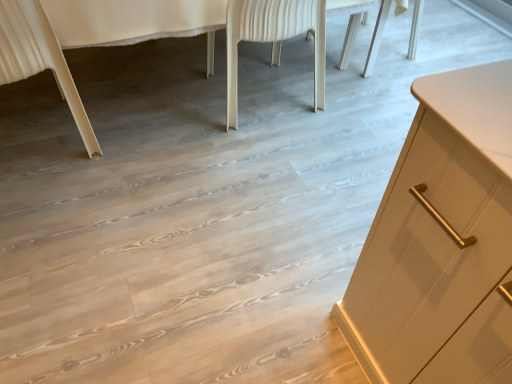
Question: From a real-world perspective, is white wood chair at center, which appears as the second chair when viewed from the left, on light beige wood chair leg at lower left, placed as the 1th chair when sorted from left to right?

Choices:
 (A) yes
 (B) no

Answer: (B)

Question: From a real-world perspective, is white wood chair at center, marked as the 1th chair in a right-to-left arrangement, under light beige wood chair leg at lower left, which is counted as the 2th chair, starting from the right?

Choices:
 (A) no
 (B) yes

Answer: (B)

Question: Is white wood chair at center, marked as the 1th chair in a right-to-left arrangement, not close to light beige wood chair leg at lower left, placed as the 1th chair when sorted from left to right?

Choices:
 (A) no
 (B) yes

Answer: (A)

Question: Does white wood chair at center, which appears as the second chair when viewed from the left, have a lesser width compared to light beige wood chair leg at lower left, placed as the 1th chair when sorted from left to right?

Choices:
 (A) no
 (B) yes

Answer: (A)

Question: Does white wood chair at center, which appears as the second chair when viewed from the left, touch light beige wood chair leg at lower left, placed as the 1th chair when sorted from left to right?

Choices:
 (A) no
 (B) yes

Answer: (A)

Question: From the image's perspective, is white wood chair at center, which appears as the second chair when viewed from the left, beneath light beige wood chair leg at lower left, placed as the 1th chair when sorted from left to right?

Choices:
 (A) yes
 (B) no

Answer: (B)

Question: Is white wood chair at center, marked as the 1th chair in a right-to-left arrangement, not within white glossy cabinet at right?

Choices:
 (A) no
 (B) yes

Answer: (A)

Question: Is white wood chair at center, which appears as the second chair when viewed from the left, oriented away from white glossy cabinet at right?

Choices:
 (A) no
 (B) yes

Answer: (B)

Question: From a real-world perspective, is white wood chair at center, marked as the 1th chair in a right-to-left arrangement, physically above white glossy cabinet at right?

Choices:
 (A) yes
 (B) no

Answer: (B)

Question: From the image's perspective, is white wood chair at center, marked as the 1th chair in a right-to-left arrangement, above white glossy cabinet at right?

Choices:
 (A) no
 (B) yes

Answer: (A)

Question: Can you confirm if white wood chair at center, marked as the 1th chair in a right-to-left arrangement, is positioned to the left of white glossy cabinet at right?

Choices:
 (A) yes
 (B) no

Answer: (B)

Question: Can you confirm if white wood chair at center, marked as the 1th chair in a right-to-left arrangement, is positioned to the right of white glossy cabinet at right?

Choices:
 (A) no
 (B) yes

Answer: (B)

Question: Does light beige wood chair leg at lower left, placed as the 1th chair when sorted from left to right, have a greater height compared to white wood chair at center, which appears as the second chair when viewed from the left?

Choices:
 (A) yes
 (B) no

Answer: (A)